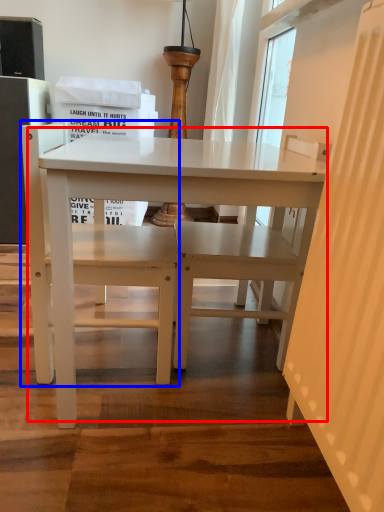
Question: Which object appears closest to the camera in this image, table (highlighted by a red box) or chair (highlighted by a blue box)?

Choices:
 (A) table
 (B) chair

Answer: (A)